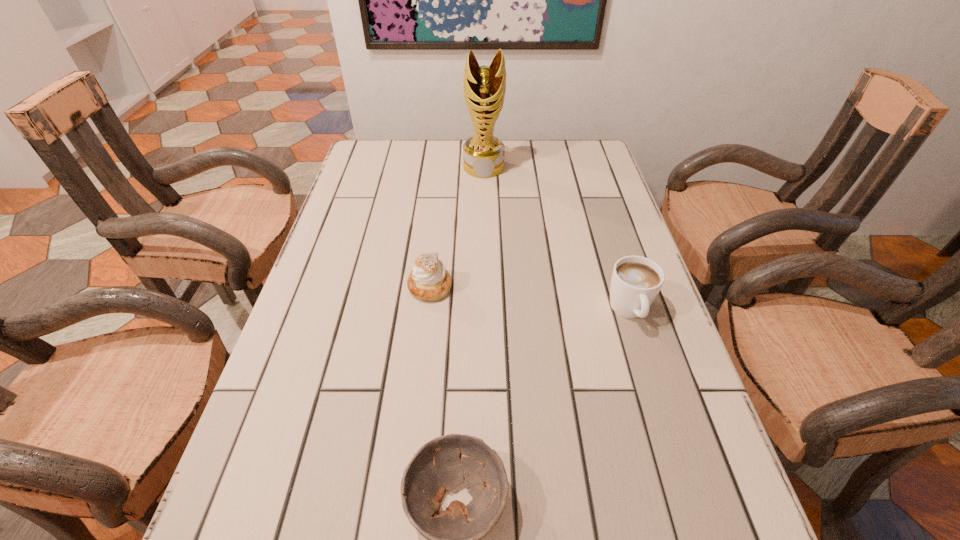
You are a GUI agent. You are given a task and a screenshot of the screen. Output one action in this format:
    pyautogui.click(x=<x>, y=<y>)
    Task: Click on the award
    Image resolution: width=960 pixels, height=540 pixels.
    Given the screenshot: What is the action you would take?
    pyautogui.click(x=484, y=87)

This screenshot has height=540, width=960. Find the location of `the farthest object`. the farthest object is located at coordinates (484, 87).

I want to click on cappuccino, so click(x=636, y=281).

Find the location of a particular element. The width and height of the screenshot is (960, 540). pastry is located at coordinates (429, 280).

At what (x,y) coordinates should I click in order to perform the action: click on free space located 0.290m on the front-facing side of the tallest object. Please return your answer as a coordinate pair (x, y). Image resolution: width=960 pixels, height=540 pixels. Looking at the image, I should click on (485, 239).

Identify the location of vacant space situated with the handle on the side of the rightmost object. The height and width of the screenshot is (540, 960). (653, 385).

This screenshot has width=960, height=540. What are the coordinates of `vacant area situated on the right of the pastry` in the screenshot? It's located at coord(524,286).

Where is `object that is at the far edge`? The height and width of the screenshot is (540, 960). object that is at the far edge is located at coordinates (484, 87).

Locate an element on the screen. object that is at the right edge is located at coordinates (636, 281).

Where is `vacant space at the far edge of the desktop`? The width and height of the screenshot is (960, 540). vacant space at the far edge of the desktop is located at coordinates (524, 152).